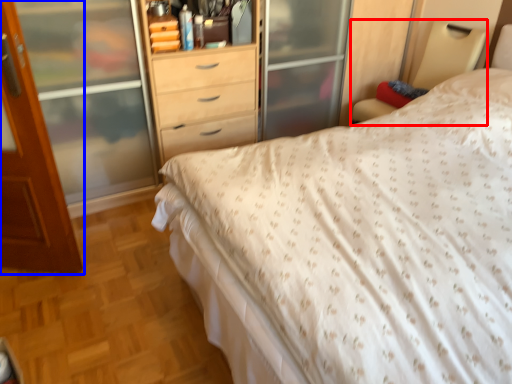
Question: Which of the following is the farthest to the observer, bed frame (highlighted by a red box) or door (highlighted by a blue box)?

Choices:
 (A) bed frame
 (B) door

Answer: (A)